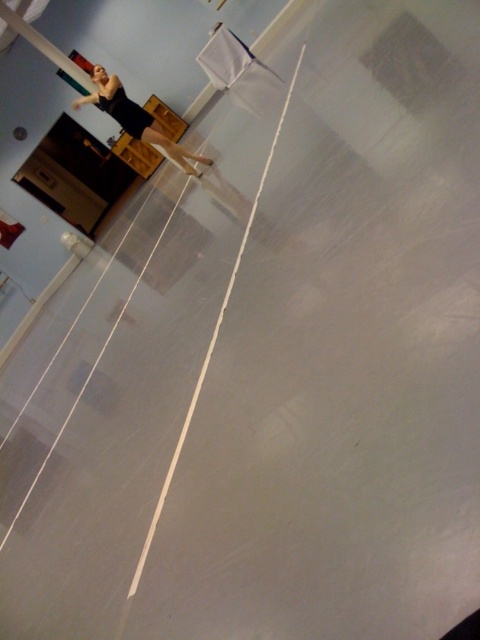
Can you confirm if black matte dress at upper left is shorter than metallic pole at upper left?

No.

Find the location of a particular element. This screenshot has height=640, width=480. black matte dress at upper left is located at coordinates (x=135, y=118).

Locate an element on the screen. The height and width of the screenshot is (640, 480). black matte dress at upper left is located at coordinates (135, 118).